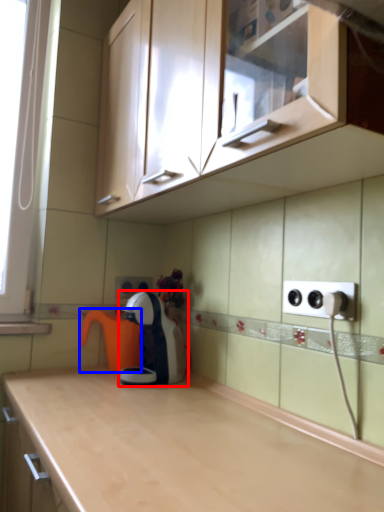
Question: Among these objects, which one is farthest to the camera, home appliance (highlighted by a red box) or coffeepot (highlighted by a blue box)?

Choices:
 (A) home appliance
 (B) coffeepot

Answer: (B)